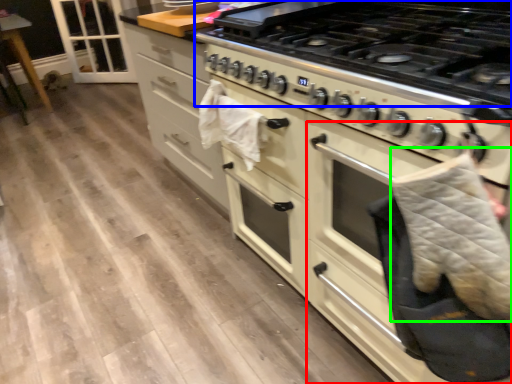
Question: Which is nearer to the oven (highlighted by a red box)? gas stove (highlighted by a blue box) or blanket (highlighted by a green box).

Choices:
 (A) gas stove
 (B) blanket

Answer: (B)